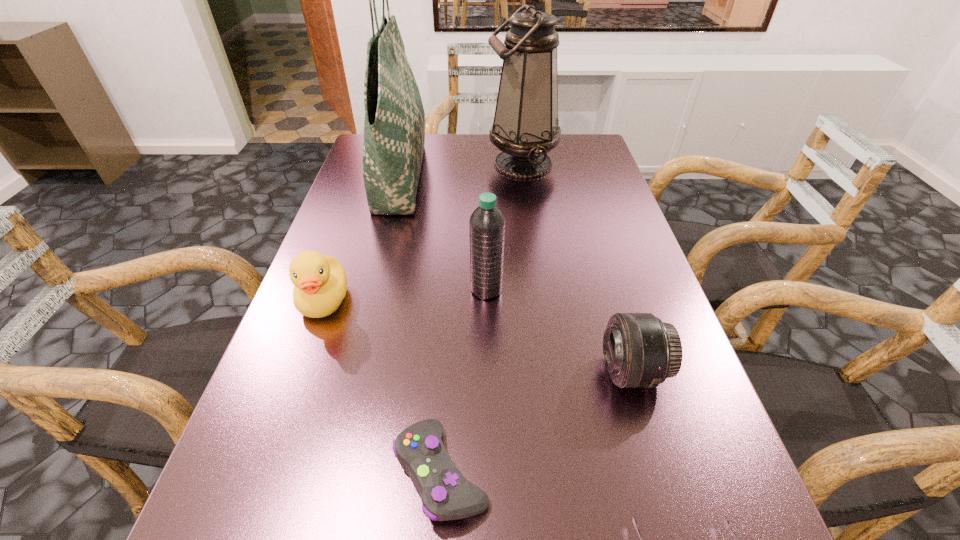
I want to click on vacant region located 0.330m on the front-facing side of the telephoto lens, so click(x=412, y=372).

The width and height of the screenshot is (960, 540). Find the location of `free location located 0.230m on the front-facing side of the telephoto lens`. free location located 0.230m on the front-facing side of the telephoto lens is located at coordinates (469, 372).

Where is `blank area located 0.130m on the front-facing side of the telephoto lens`? blank area located 0.130m on the front-facing side of the telephoto lens is located at coordinates (527, 372).

Locate an element on the screen. vacant area situated 0.100m on the right of the control is located at coordinates (558, 472).

Locate an element on the screen. This screenshot has height=540, width=960. tote bag that is at the far edge is located at coordinates (394, 128).

Where is `oil lamp that is at the far edge`? oil lamp that is at the far edge is located at coordinates (525, 128).

In order to click on tote bag at the left edge in this screenshot , I will do `click(394, 128)`.

At what (x,y) coordinates should I click in order to perform the action: click on duck situated at the left edge. Please return your answer as a coordinate pair (x, y). This screenshot has height=540, width=960. Looking at the image, I should click on (320, 281).

Identify the location of oil lamp at the right edge. (525, 128).

This screenshot has height=540, width=960. What are the coordinates of `telephoto lens at the right edge` in the screenshot? It's located at (640, 351).